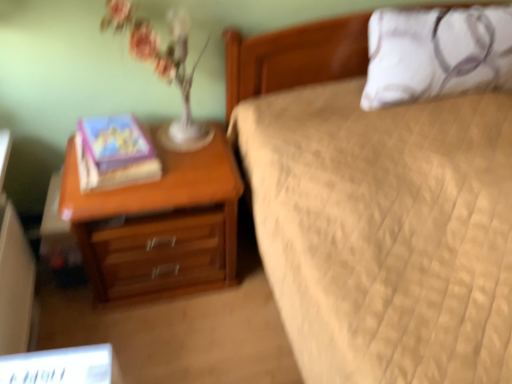
Image resolution: width=512 pixels, height=384 pixels. What do you see at coordinates (164, 67) in the screenshot? I see `translucent glass vase at upper left` at bounding box center [164, 67].

The width and height of the screenshot is (512, 384). What do you see at coordinates (437, 53) in the screenshot?
I see `white textured pillow at upper right` at bounding box center [437, 53].

What is the approximate width of wooden nightstand at left?

The width of wooden nightstand at left is 18.55 inches.

This screenshot has width=512, height=384. I want to click on wooden nightstand at left, so click(x=159, y=227).

What do you see at coordinates (114, 153) in the screenshot? This screenshot has height=384, width=512. I see `matte purple book at left` at bounding box center [114, 153].

Locate an element on the screen. The height and width of the screenshot is (384, 512). translucent glass vase at upper left is located at coordinates click(164, 67).

Does point (120, 14) come closer to viewer compared to point (126, 173)?

Yes, point (120, 14) is closer to viewer.

From a real-world perspective, relative to matte purple book at left, is translucent glass vase at upper left vertically above or below?

Clearly, from a real-world perspective, translucent glass vase at upper left is above matte purple book at left.

How many degrees apart are the facing directions of translucent glass vase at upper left and matte purple book at left?

The facing directions of translucent glass vase at upper left and matte purple book at left are 5.71 degrees apart.

Which object is closer to the camera taking this photo, translucent glass vase at upper left or matte purple book at left?

translucent glass vase at upper left is closer to the camera.

Is matte purple book at left not within translucent glass vase at upper left?

That's correct, matte purple book at left is outside of translucent glass vase at upper left.

Is matte purple book at left aimed at translucent glass vase at upper left?

No, matte purple book at left is not aimed at translucent glass vase at upper left.

Based on the photo, which object is more forward, matte purple book at left or translucent glass vase at upper left?

translucent glass vase at upper left is closer to the camera.

From a real-world perspective, is matte purple book at left on translucent glass vase at upper left?

No, from a real-world perspective, matte purple book at left is not over translucent glass vase at upper left

I want to click on nightstand below the translucent glass vase at upper left (from the image's perspective), so click(x=159, y=227).

Is translucent glass vase at upper left inside or outside of wooden nightstand at left?

translucent glass vase at upper left exists outside the volume of wooden nightstand at left.

From the image's perspective, is translucent glass vase at upper left on wooden nightstand at left?

Indeed, from the image's perspective, translucent glass vase at upper left is shown above wooden nightstand at left.

Are translucent glass vase at upper left and wooden nightstand at left beside each other?

No, translucent glass vase at upper left is not making contact with wooden nightstand at left.

From a real-world perspective, is matte purple book at left positioned above or below white textured pillow at upper right?

In terms of real-world spatial position, matte purple book at left is below white textured pillow at upper right.

Who is more distant, matte purple book at left or white textured pillow at upper right?

white textured pillow at upper right.

Which of these two, matte purple book at left or white textured pillow at upper right, is thinner?

white textured pillow at upper right.

How different are the orientations of wooden nightstand at left and matte purple book at left in degrees?

The angle between the facing direction of wooden nightstand at left and the facing direction of matte purple book at left is 6.96 degrees.

You are a GUI agent. You are given a task and a screenshot of the screen. Output one action in this format:
    pyautogui.click(x=<x>, y=<y>)
    Task: Click on the book on the left of wooden nightstand at left
    
    Given the screenshot: What is the action you would take?
    pyautogui.click(x=114, y=153)

Is wooden nightstand at left not within matte purple book at left?

wooden nightstand at left lies outside matte purple book at left's area.

Is point (119, 256) in front of point (156, 177)?

No, (119, 256) is further to viewer.

Does wooden nightstand at left have a lesser height compared to white textured pillow at upper right?

In fact, wooden nightstand at left may be taller than white textured pillow at upper right.

Measure the distance from wooden nightstand at left to white textured pillow at upper right.

wooden nightstand at left and white textured pillow at upper right are 32.61 inches apart.

Which is nearer, (174, 160) or (500, 14)?

The point (174, 160) is closer to the camera.

Is wooden nightstand at left oriented towards white textured pillow at upper right?

No, wooden nightstand at left is not oriented towards white textured pillow at upper right.

Does point (471, 64) come behind point (187, 120)?

No, (471, 64) is closer to viewer.

Which of these two, white textured pillow at upper right or translucent glass vase at upper left, is wider?

Wider between the two is white textured pillow at upper right.

Measure the distance from white textured pillow at upper right to translucent glass vase at upper left.

white textured pillow at upper right and translucent glass vase at upper left are 31.38 inches apart from each other.

Locate an element on the screen. Image resolution: width=512 pixels, height=384 pixels. book that is under the translucent glass vase at upper left (from a real-world perspective) is located at coordinates (114, 153).

Where is `floral arrangement above the matte purple book at left (from a real-world perspective)`? floral arrangement above the matte purple book at left (from a real-world perspective) is located at coordinates (164, 67).

Which object lies nearer to the anchor point white textured pillow at upper right, wooden nightstand at left or translucent glass vase at upper left?

translucent glass vase at upper left is positioned closer to the anchor white textured pillow at upper right.

Estimate the real-world distances between objects in this image. Which object is closer to wooden nightstand at left, white textured pillow at upper right or translucent glass vase at upper left?

Among the two, translucent glass vase at upper left is located nearer to wooden nightstand at left.

When comparing their distances from matte purple book at left, does translucent glass vase at upper left or white textured pillow at upper right seem further?

white textured pillow at upper right lies further to matte purple book at left than the other object.

Based on their spatial positions, is translucent glass vase at upper left or wooden nightstand at left further from white textured pillow at upper right?

The object further to white textured pillow at upper right is wooden nightstand at left.

From the image, which object appears to be farther from wooden nightstand at left, white textured pillow at upper right or matte purple book at left?

white textured pillow at upper right is positioned further to the anchor wooden nightstand at left.

Looking at the image, which one is located further to white textured pillow at upper right, wooden nightstand at left or matte purple book at left?

Based on the image, matte purple book at left appears to be further to white textured pillow at upper right.

Considering their positions, is wooden nightstand at left positioned closer to matte purple book at left than translucent glass vase at upper left?

wooden nightstand at left lies closer to matte purple book at left than the other object.

When comparing their distances from wooden nightstand at left, does translucent glass vase at upper left or matte purple book at left seem closer?

Based on the image, matte purple book at left appears to be nearer to wooden nightstand at left.

I want to click on floral arrangement between wooden nightstand at left and white textured pillow at upper right from left to right, so click(164, 67).

Locate an element on the screen. The height and width of the screenshot is (384, 512). book between translucent glass vase at upper left and wooden nightstand at left from top to bottom is located at coordinates (114, 153).

Find the location of `nightstand between matte purple book at left and white textured pillow at upper right from left to right`. nightstand between matte purple book at left and white textured pillow at upper right from left to right is located at coordinates (159, 227).

At what (x,y) coordinates should I click in order to perform the action: click on floral arrangement between matte purple book at left and white textured pillow at upper right. Please return your answer as a coordinate pair (x, y). Image resolution: width=512 pixels, height=384 pixels. Looking at the image, I should click on (164, 67).